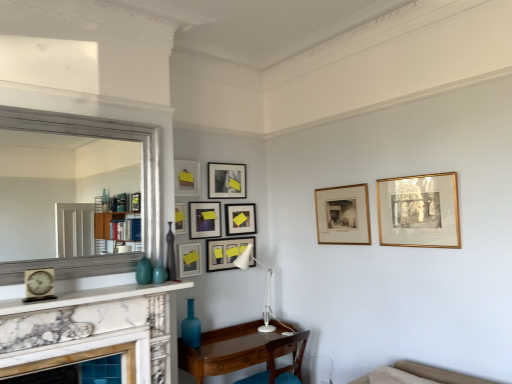
This screenshot has height=384, width=512. What are the coordinates of `free space above silver metallic mirror at left (from a real-world perspective)` in the screenshot? It's located at (83, 109).